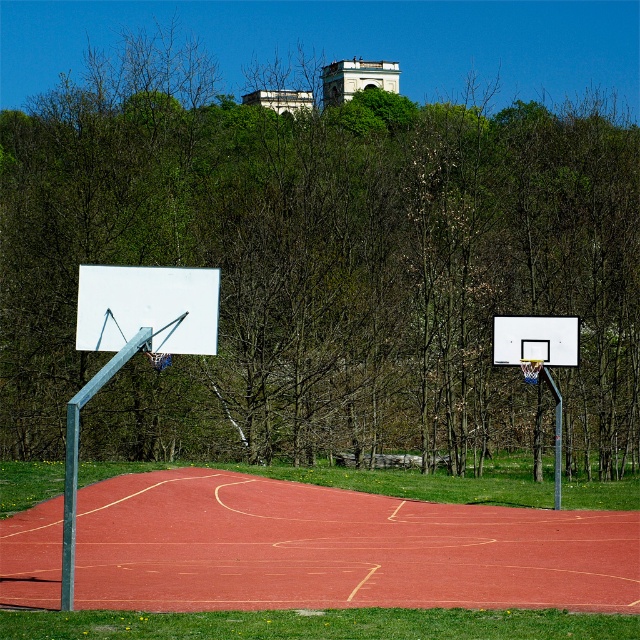
Is brown leafless tree at center wider than white glossy basketball backboard at center?

Yes.

Can you confirm if brown leafless tree at center is positioned below white glossy basketball backboard at center?

Actually, brown leafless tree at center is above white glossy basketball backboard at center.

Is point (202, 6) more distant than point (554, 337)?

Yes, it is behind point (554, 337).

Locate an element on the screen. brown leafless tree at center is located at coordinates (320, 262).

Can you confirm if brown leafless tree at center is taller than rubberized red basketball court at center?

Yes, brown leafless tree at center is taller than rubberized red basketball court at center.

Can you confirm if brown leafless tree at center is positioned below rubberized red basketball court at center?

Actually, brown leafless tree at center is above rubberized red basketball court at center.

Identify the location of brown leafless tree at center. This screenshot has height=640, width=640. (320, 262).

Image resolution: width=640 pixels, height=640 pixels. Identify the location of brown leafless tree at center. (320, 262).

Can you confirm if rubberized red basketball court at center is positioned to the left of white matte basketball backboard at left?

No, rubberized red basketball court at center is not to the left of white matte basketball backboard at left.

Can you confirm if rubberized red basketball court at center is thinner than white matte basketball backboard at left?

No.

Which is behind, point (570, 547) or point (157, 278)?

Positioned behind is point (570, 547).

At what (x,y) coordinates should I click in order to perform the action: click on rubberized red basketball court at center. Please return your answer as a coordinate pair (x, y). This screenshot has width=640, height=640. Looking at the image, I should click on (337, 548).